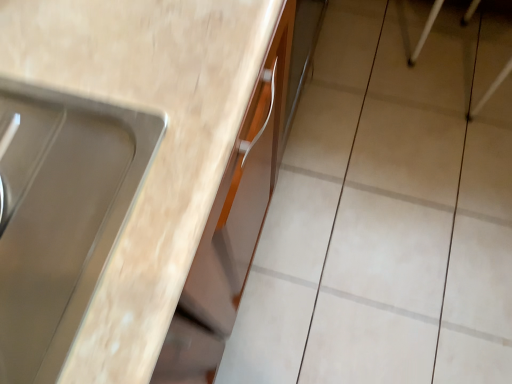
Question: Considering the positions of matte wood countertop at center and beige ceramic tile at upper right in the image, is matte wood countertop at center taller or shorter than beige ceramic tile at upper right?

Choices:
 (A) short
 (B) tall

Answer: (B)

Question: Visually, is matte wood countertop at center positioned to the left or to the right of beige ceramic tile at upper right?

Choices:
 (A) left
 (B) right

Answer: (A)

Question: From a real-world perspective, is matte wood countertop at center above or below beige ceramic tile at upper right?

Choices:
 (A) below
 (B) above

Answer: (B)

Question: Is beige ceramic tile at upper right taller or shorter than matte wood countertop at center?

Choices:
 (A) short
 (B) tall

Answer: (A)

Question: Is beige ceramic tile at upper right inside or outside of matte wood countertop at center?

Choices:
 (A) inside
 (B) outside

Answer: (B)

Question: Is point (441, 41) positioned closer to the camera than point (153, 350)?

Choices:
 (A) closer
 (B) farther

Answer: (B)

Question: From a real-world perspective, relative to matte wood countertop at center, is beige ceramic tile at upper right vertically above or below?

Choices:
 (A) above
 (B) below

Answer: (B)